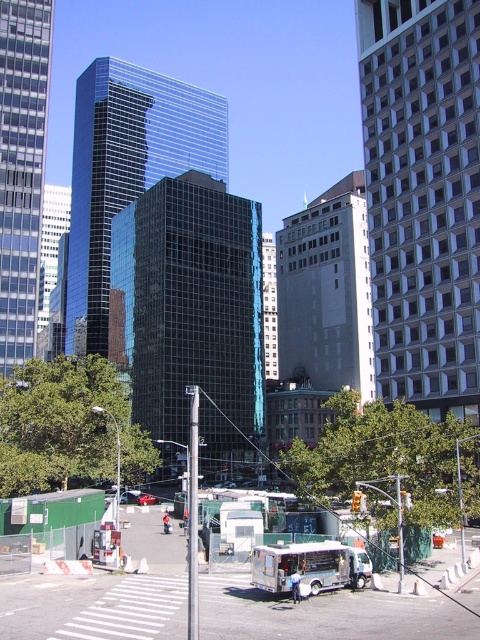
Question: Among these points, which one is farthest from the camera?

Choices:
 (A) (337, 576)
 (B) (206, 577)

Answer: (B)

Question: Which point is farther to the camera?

Choices:
 (A) (151, 500)
 (B) (277, 592)
 (C) (225, 609)

Answer: (A)

Question: Can you confirm if green plastic containers at center is positioned above metallic red car at center?

Choices:
 (A) no
 (B) yes

Answer: (B)

Question: Is green plastic containers at center to the left of metallic red car at center from the viewer's perspective?

Choices:
 (A) yes
 (B) no

Answer: (B)

Question: Observing the image, what is the correct spatial positioning of green plastic containers at center in reference to metallic red car at center?

Choices:
 (A) above
 (B) below

Answer: (A)

Question: Among these points, which one is nearest to the camera?

Choices:
 (A) (49, 627)
 (B) (308, 584)
 (C) (144, 499)

Answer: (A)